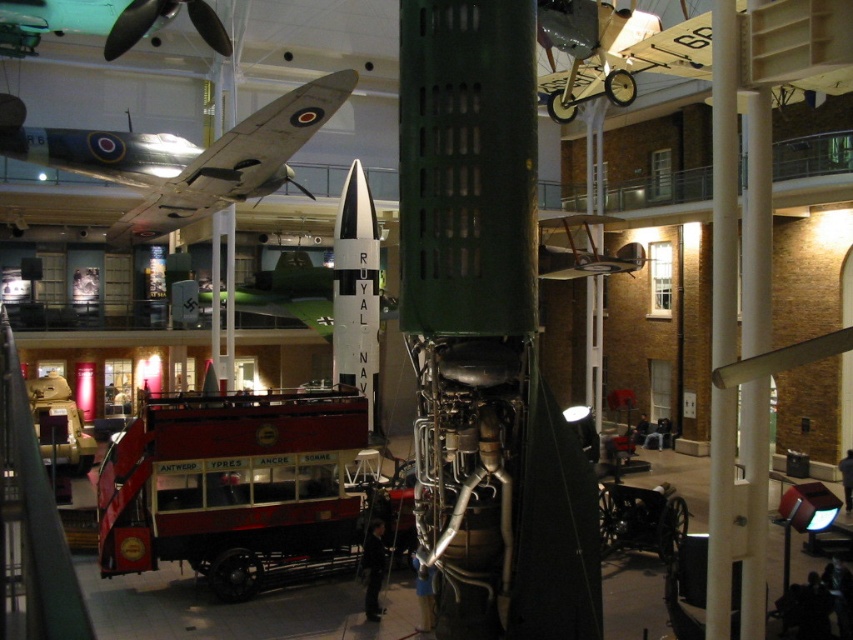
You are standing in the museum and want to locate two specific points marked on the rocket display. The first point is at coordinates point (244, 129) and the second point is at point (117, 44). Which of these points is nearer to your current position?

Point (244, 129) is closer to the viewer than point (117, 44), so the first point is nearer to your current position.

You are a tour guide giving a tour of the museum. You want to point out both the polished silver airplane at upper left and the white matte royal navy missile at center to your visitors. Which object should you mention first so that visitors can see it without obstruction from the other object?

The polished silver airplane at upper left should be mentioned first because it is in front of the white matte royal navy missile at center, so mentioning it first allows visitors to see it without obstruction from the missile.